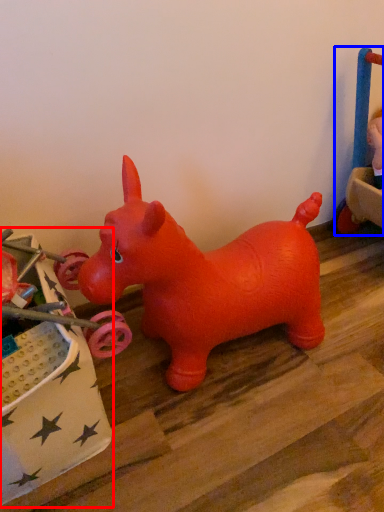
Question: Among these objects, which one is farthest to the camera, toy (highlighted by a red box) or toy (highlighted by a blue box)?

Choices:
 (A) toy
 (B) toy

Answer: (B)